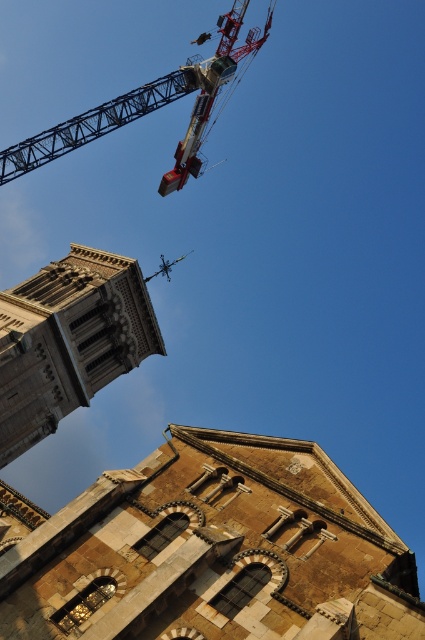
Between brown stone tower at center and stone tower at center, which one has less height?

brown stone tower at center

Does brown stone tower at center appear over stone tower at center?

No, brown stone tower at center is not above stone tower at center.

At what (x,y) coordinates should I click in order to perform the action: click on brown stone tower at center. Please return your answer as a coordinate pair (x, y). This screenshot has width=425, height=640. Looking at the image, I should click on (209, 550).

Where is `brown stone tower at center`? The image size is (425, 640). brown stone tower at center is located at coordinates (209, 550).

Can you confirm if brown stone tower at center is thinner than metallic gray crane at upper center?

Yes.

Which is more to the right, brown stone tower at center or metallic gray crane at upper center?

brown stone tower at center is more to the right.

What are the coordinates of `brown stone tower at center` in the screenshot? It's located at (209, 550).

Is point (130, 301) closer to camera compared to point (221, 61)?

Yes, point (130, 301) is in front of point (221, 61).

How much distance is there between stone tower at center and metallic gray crane at upper center?

They are 32.23 meters apart.

Locate an element on the screen. The width and height of the screenshot is (425, 640). stone tower at center is located at coordinates (68, 340).